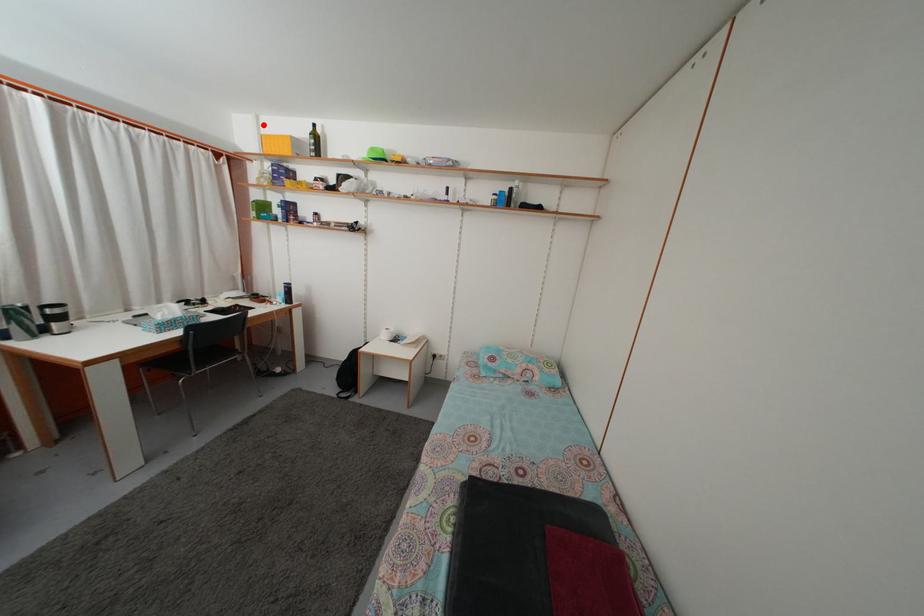
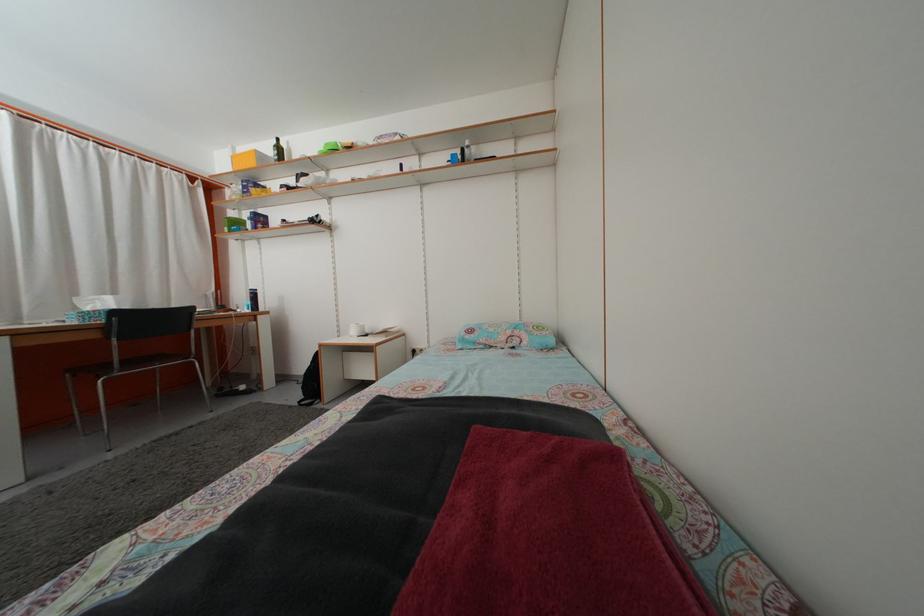
Where in the second image is the point corresponding to the highlighted location from the first image?

(239, 156)